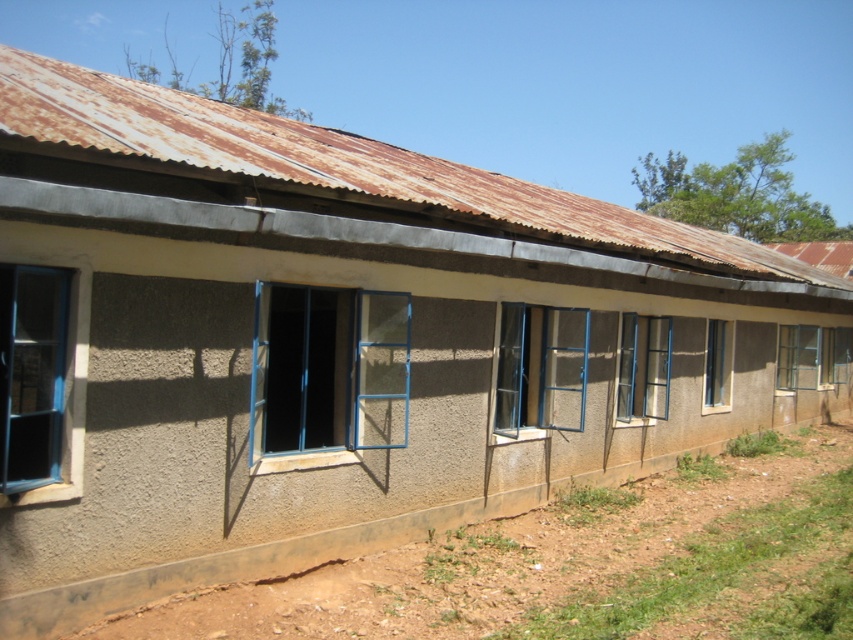
Question: Which point appears farthest from the camera in this image?

Choices:
 (A) (502, 416)
 (B) (827, 339)
 (C) (18, 396)
 (D) (619, 384)

Answer: (B)

Question: Is the position of blue painted metal window at center less distant than that of matte blue glass window at center?

Choices:
 (A) yes
 (B) no

Answer: (A)

Question: Which of these objects is positioned closest to the clear glass window at center right?

Choices:
 (A) brown dirt track at lower left
 (B) clear glass window at center

Answer: (B)

Question: Considering the relative positions of matte blue glass window at center and clear glass window at center in the image provided, where is matte blue glass window at center located with respect to clear glass window at center?

Choices:
 (A) below
 (B) above

Answer: (B)

Question: Which point is farther from the camera taking this photo?

Choices:
 (A) coord(560,333)
 (B) coord(21,326)
 (C) coord(256,387)
 (D) coord(726,339)

Answer: (D)

Question: Is metallic blue window at center to the left of clear glass window at center right from the viewer's perspective?

Choices:
 (A) no
 (B) yes

Answer: (B)